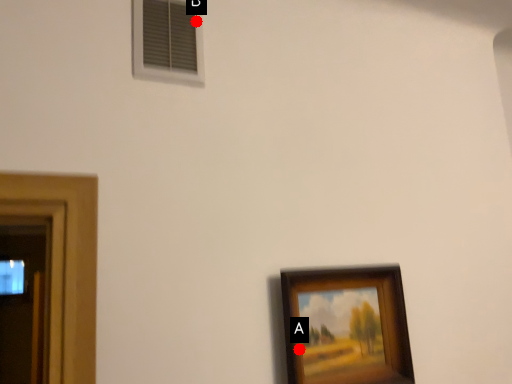
Question: Two points are circled on the image, labeled by A and B beside each circle. Which point appears closest to the camera in this image?

Choices:
 (A) A is closer
 (B) B is closer

Answer: (A)